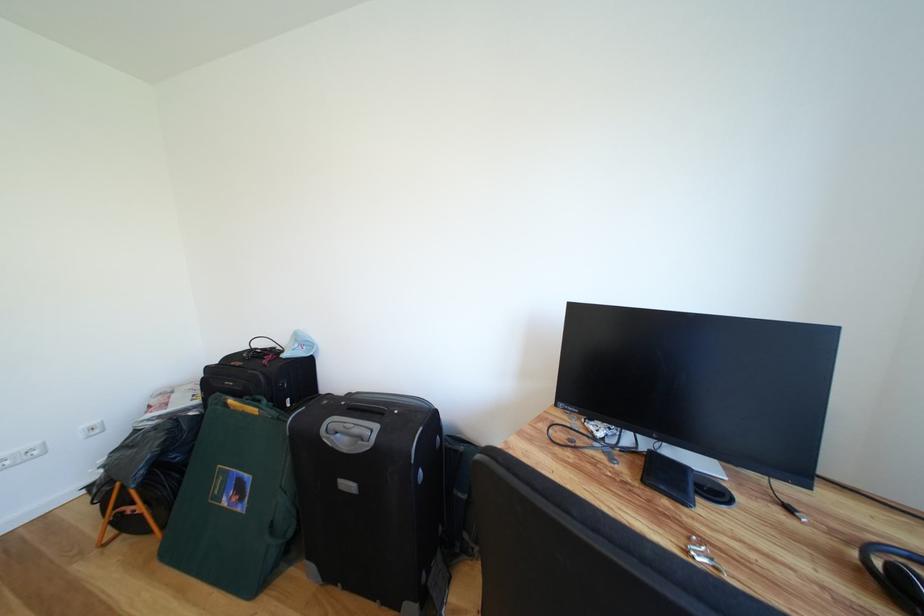
What do you see at coordinates (371, 495) in the screenshot?
I see `the gray suitcase handle` at bounding box center [371, 495].